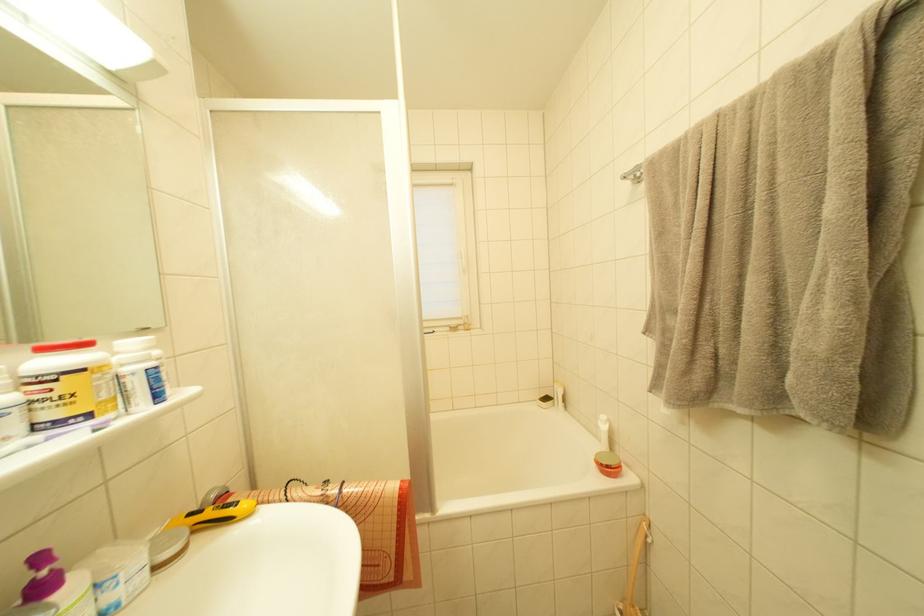
This screenshot has width=924, height=616. In order to click on white bottle in this screenshot , I will do `click(64, 387)`.